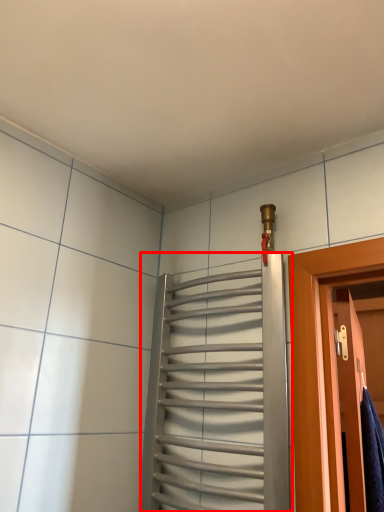
Question: Where is elevator (annotated by the red box) located in relation to door in the image?

Choices:
 (A) left
 (B) right

Answer: (A)